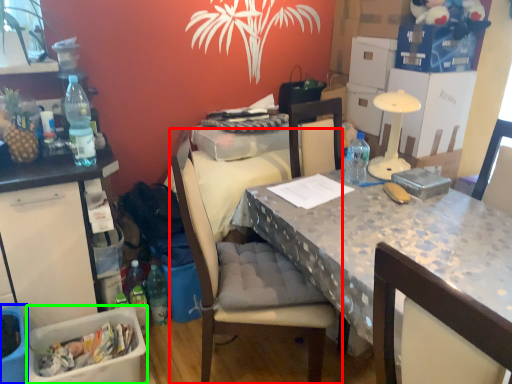
Question: Which is farther away from chair (highlighted by a red box)? picnic basket (highlighted by a blue box) or box (highlighted by a green box)?

Choices:
 (A) picnic basket
 (B) box

Answer: (A)